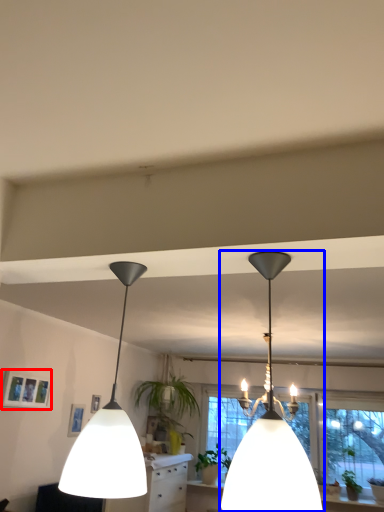
Question: Among these objects, which one is nearest to the camera, picture frame (highlighted by a red box) or lamp (highlighted by a blue box)?

Choices:
 (A) picture frame
 (B) lamp

Answer: (B)